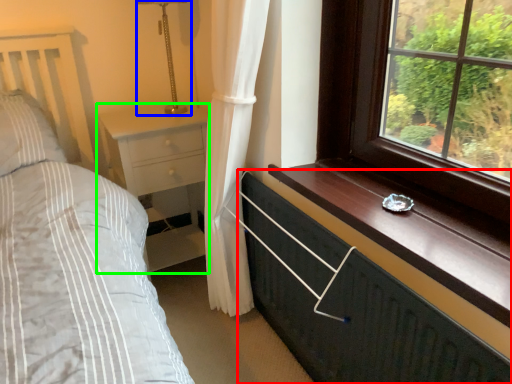
Question: Which object is positioned closest to chest of drawers (highlighted by a red box)? Select from table lamp (highlighted by a blue box) and nightstand (highlighted by a green box).

Choices:
 (A) table lamp
 (B) nightstand

Answer: (B)